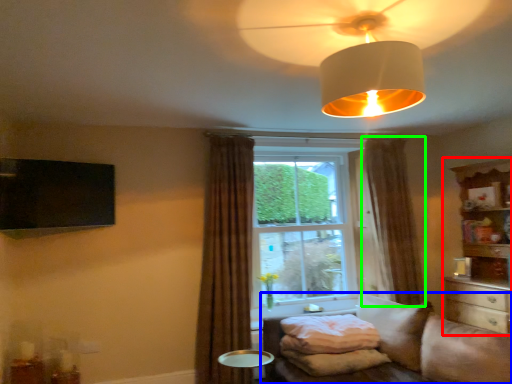
Question: Estimate the real-world distances between objects in this image. Which object is closer to entertainment center (highlighted by a red box), studio couch (highlighted by a blue box) or curtain (highlighted by a green box)?

Choices:
 (A) studio couch
 (B) curtain

Answer: (B)